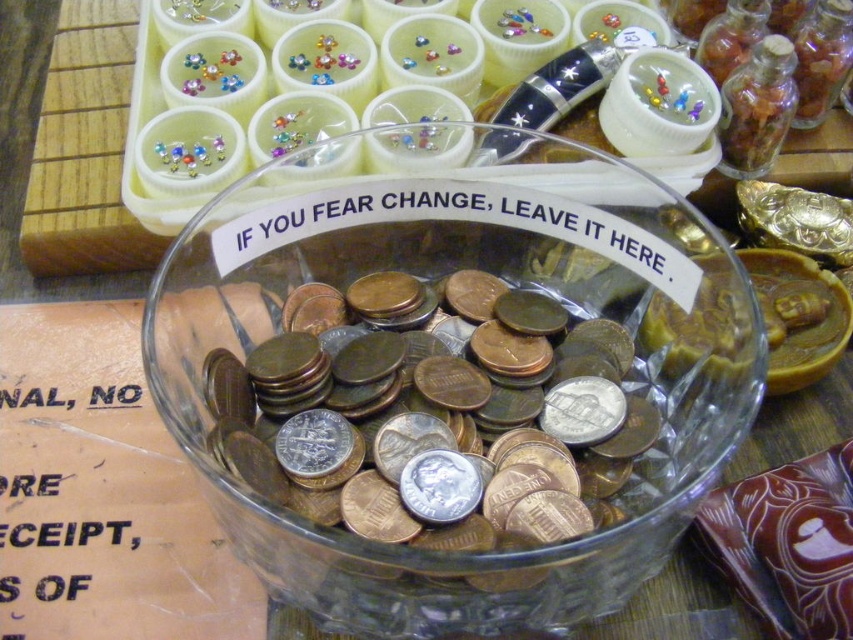
You are a person with a 6.5 inch long ruler. You want to measure the distance between yourself and the clear glass bowl at center. Can you reach the bowl with your ruler?

The clear glass bowl at center and viewer are 6.28 inches apart from each other. Since the ruler is 6.5 inches long, it can extend beyond the 6.28 inches distance, so yes, you can reach the bowl with your ruler.

You are organizing a craft fair and have a small decorative box that is 10 cm wide. You need to place it next to the clear glass bowl at center and the silver metallic coins at center. Which object can the box fit next to without overlapping?

The clear glass bowl at center has a larger width than the silver metallic coins at center. Since the box is 10 cm wide, it can fit next to the silver metallic coins at center without overlapping because they are narrower.

You are organizing items on a wooden table and see the clear glass bowl at center and the silver metallic coins at center. Based on their positions, which item is closer to you?

The clear glass bowl at center is closer to you because it is located above the silver metallic coins at center, indicating it is positioned in front of them.